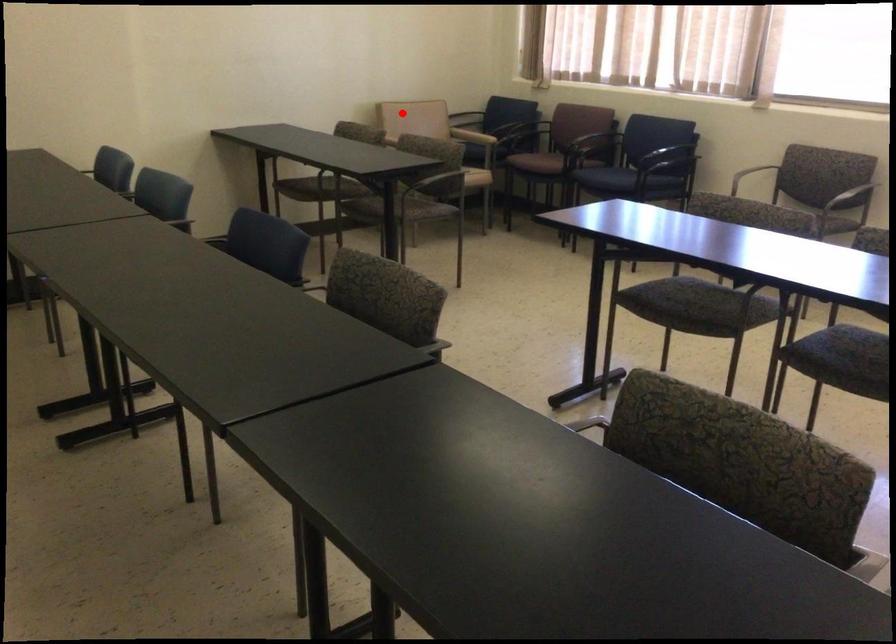
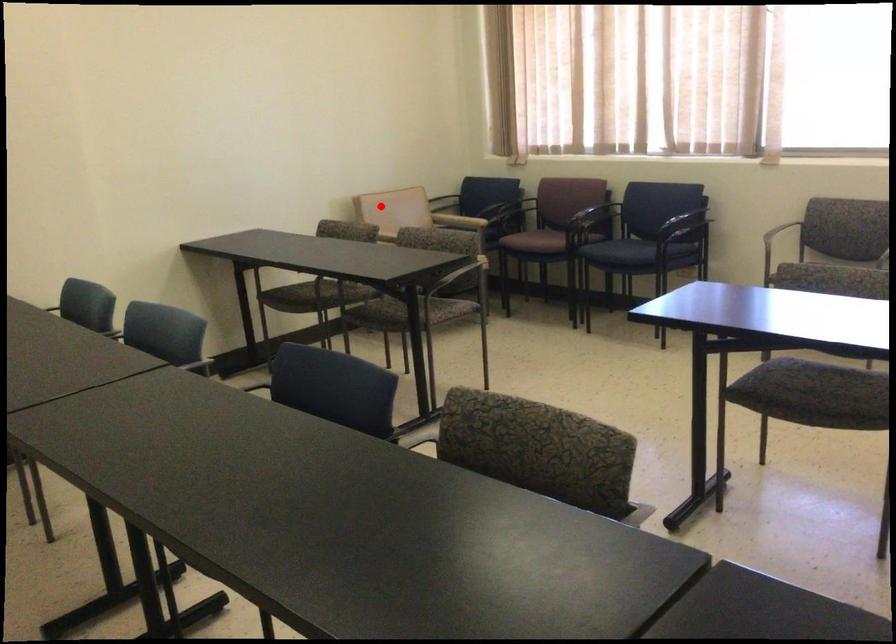
Consider the image. I am providing you with two images of the same scene from different viewpoints. A red point is marked on the first image and another point is marked on the second image. Are the points marked in image1 and image2 representing the same 3D position?

Yes